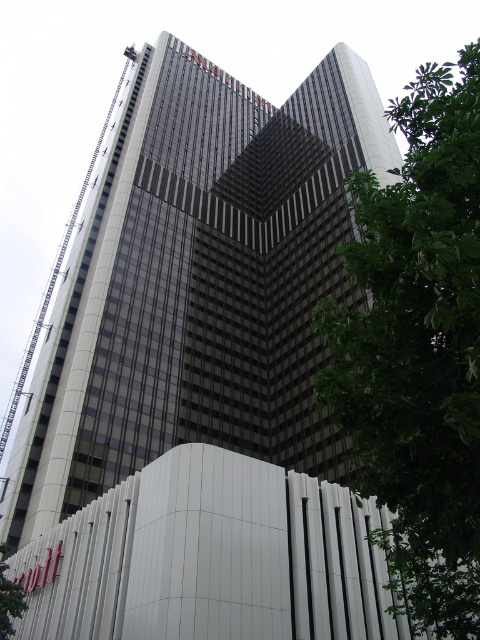
You are standing in front of the modern high rise building and want to take a photo of both the point at coordinates point (186, 198) and point (398, 244). Which point will appear closer to the center of the photo when you take the picture?

Point (186, 198) is further to the camera than point (398, 244), so when taking the photo, point (186, 198) will appear closer to the center of the photo because it is nearer to the camera.

You are standing in front of the modern high rise building. You notice the glassy reflective skyscraper at center and the green leafy tree at right. Which object takes up more space in the image?

The green leafy tree at right occupies more space than the glassy reflective skyscraper at center according to the description.

You are standing in front of the glassy reflective skyscraper at center and want to take a photo of the green leafy tree at right. Will the tree be visible in the reflection of the skyscraper?

The glassy reflective skyscraper at center is further to the viewer than green leafy tree at right, so the tree is behind the skyscraper. Since the skyscraper is closer to you, its reflection would show what is behind it, but the tree is in front of it, so the reflection might not capture the tree unless the angle allows it. However, based on the given information, the tree is behind the skyscraper in terms of depth, so it might not be visible in the reflection.